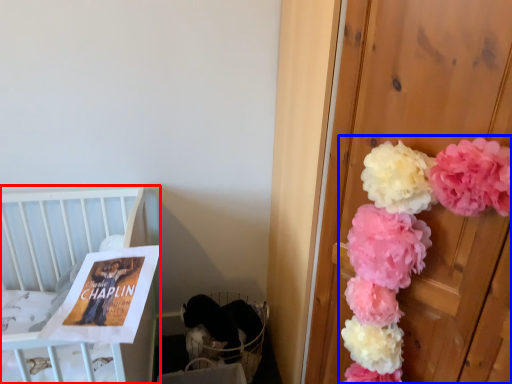
Question: Among these objects, which one is farthest to the camera, furniture (highlighted by a red box) or floral arrangement (highlighted by a blue box)?

Choices:
 (A) furniture
 (B) floral arrangement

Answer: (A)